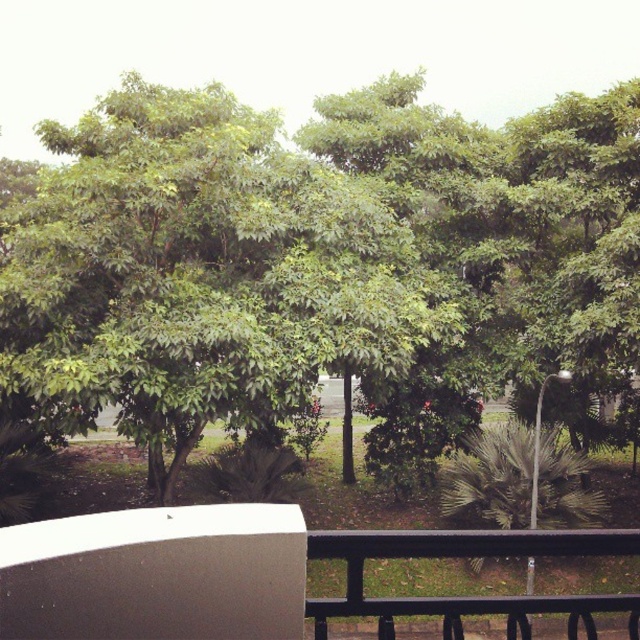
Consider the image. Between green leafy tree at center and black metal/rail at lower center, which one appears on the left side from the viewer's perspective?

green leafy tree at center is more to the left.

Can you confirm if green leafy tree at center is bigger than black metal/rail at lower center?

Yes.

At what (x,y) coordinates should I click in order to perform the action: click on green leafy tree at center. Please return your answer as a coordinate pair (x, y). The height and width of the screenshot is (640, 640). Looking at the image, I should click on (321, 262).

Locate an element on the screen. The image size is (640, 640). green leafy tree at center is located at coordinates (321, 262).

Between point (32, 618) and point (378, 598), which one is positioned behind?

Positioned behind is point (378, 598).

Who is more distant from viewer, (x=76, y=538) or (x=467, y=602)?

Point (x=467, y=602)

Locate an element on the screen. white matte balcony at lower left is located at coordinates (243, 573).

Who is more distant from viewer, [202,365] or [561,596]?

The point [202,365] is more distant.

Describe the element at coordinates (321, 262) in the screenshot. I see `green leafy tree at center` at that location.

Is point (301, 176) in front of point (248, 502)?

No, (301, 176) is further to viewer.

The height and width of the screenshot is (640, 640). I want to click on green leafy tree at center, so click(321, 262).